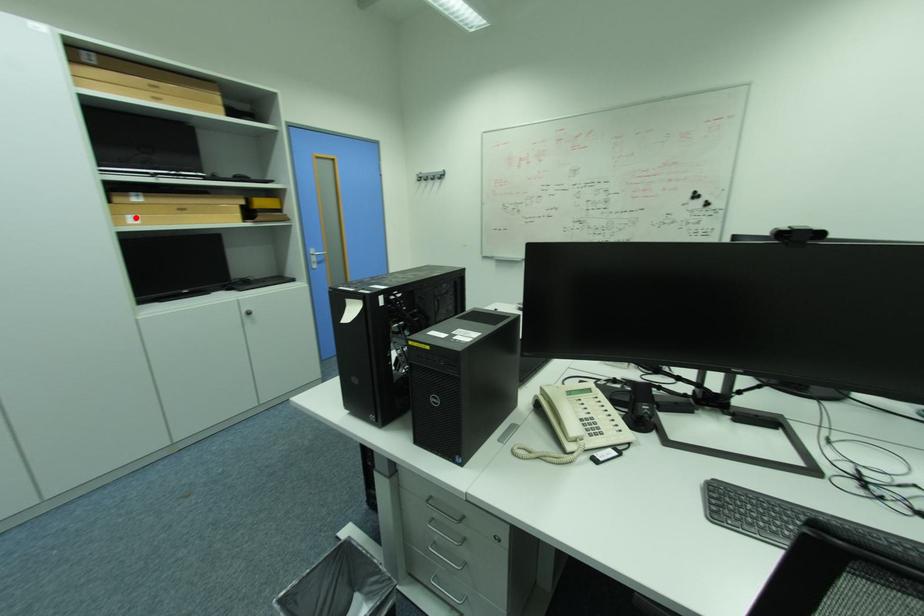
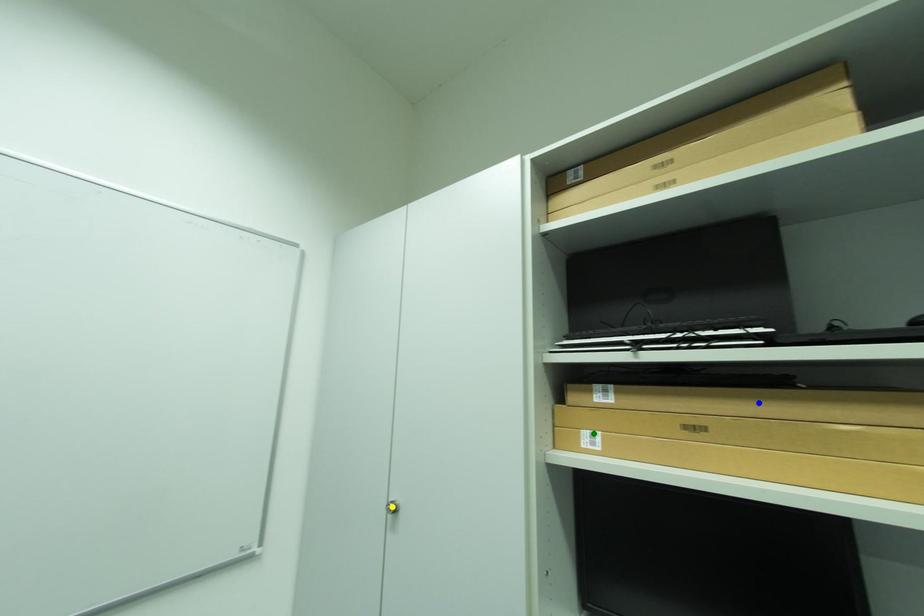
Question: I am providing you with two images of the same scene from different viewpoints. A red point is marked on the first image. You are given multiple points on the second image. Which point in image 2 is actually the same real-world point as the red point in image 1?

Choices:
 (A) blue point
 (B) yellow point
 (C) green point

Answer: (C)